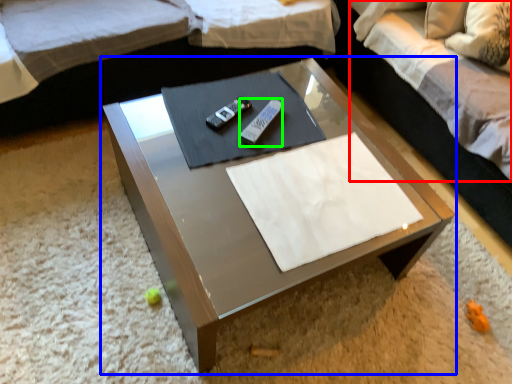
Question: Based on their relative distances, which object is nearer to bedding (highlighted by a red box)? Choose from coffee table (highlighted by a blue box) and remote (highlighted by a green box).

Choices:
 (A) coffee table
 (B) remote

Answer: (A)